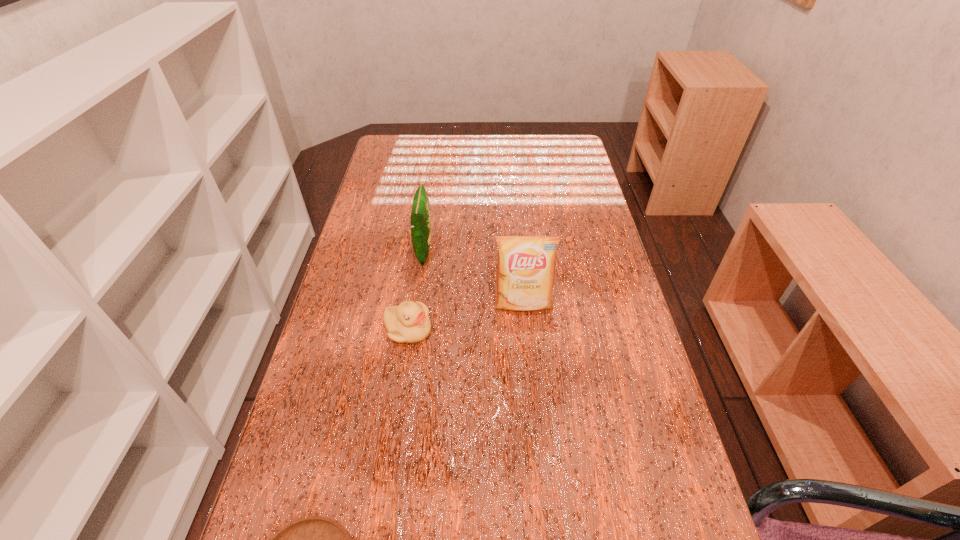
At what (x,y) coordinates should I click in order to perform the action: click on the right crisp (potato chip). Please return your answer as a coordinate pair (x, y). Image resolution: width=960 pixels, height=540 pixels. Looking at the image, I should click on (525, 275).

Locate an element on the screen. The image size is (960, 540). the rightmost object is located at coordinates (525, 275).

You are a GUI agent. You are given a task and a screenshot of the screen. Output one action in this format:
    pyautogui.click(x=<x>, y=<y>)
    Task: Click on the left crisp (potato chip)
    
    Given the screenshot: What is the action you would take?
    pyautogui.click(x=420, y=222)

Where is `the farther crisp (potato chip)`? The height and width of the screenshot is (540, 960). the farther crisp (potato chip) is located at coordinates (420, 222).

In order to click on duckling in this screenshot , I will do `click(409, 322)`.

Find the location of `free region located on the front-facing side of the right crisp (potato chip)`. free region located on the front-facing side of the right crisp (potato chip) is located at coordinates point(530,381).

Where is `vacant space located 0.060m on the front-facing side of the farther crisp (potato chip)`? This screenshot has height=540, width=960. vacant space located 0.060m on the front-facing side of the farther crisp (potato chip) is located at coordinates (454, 251).

Where is `vacant space situated on the beak of the duckling`? The image size is (960, 540). vacant space situated on the beak of the duckling is located at coordinates (506, 330).

This screenshot has height=540, width=960. In order to click on object that is at the left edge in this screenshot , I will do `click(409, 322)`.

The image size is (960, 540). In the image, there is a desktop. In order to click on vacant space at the far edge in this screenshot , I will do (510, 147).